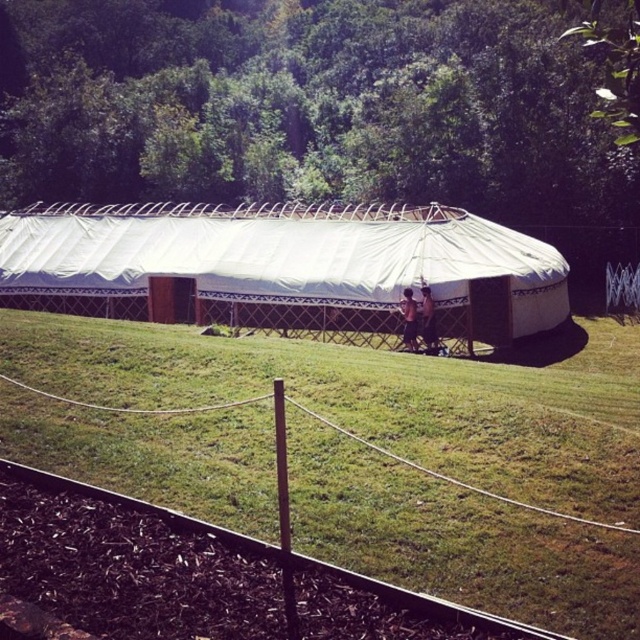
You are planning to set up a small picnic blanket in the area. Given the green grass at center and the white canvas tent at center, which area would allow you to place a larger picnic blanket without overlapping any objects?

The white canvas tent at center has a greater width than the green grass at center, so placing the picnic blanket on the green grass at center may be more limited in size due to its narrower space. The white canvas tent at center offers a wider area, allowing for a larger picnic blanket.

You are planning to set up a picnic blanket in the green grass at center. Considering the space available, will there be enough room for both the picnic blanket and the white canvas tent at center?

The green grass at center occupies less space than the white canvas tent at center, so there might not be enough room for both the picnic blanket and the white canvas tent at center.